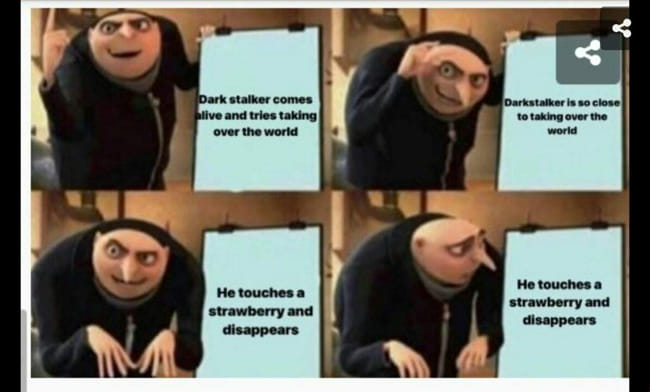
In order to click on dry erase board in this screenshot , I will do `click(545, 157)`, `click(238, 50)`, `click(586, 257)`.